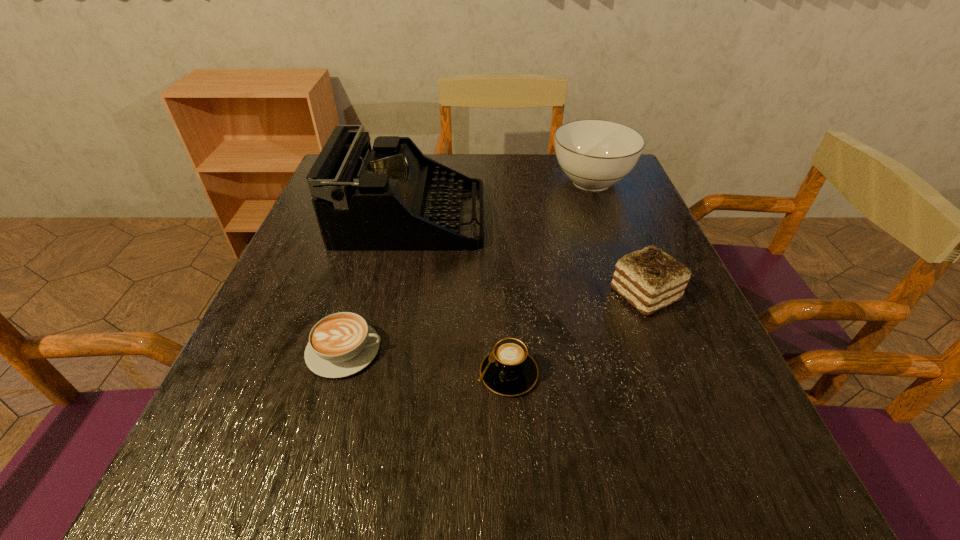
This screenshot has height=540, width=960. What are the coordinates of `free location located on the left of the chocolate cake` in the screenshot? It's located at (586, 294).

At what (x,y) coordinates should I click in order to perform the action: click on vacant area situated on the back of the right cappuccino. Please return your answer as a coordinate pair (x, y). Looking at the image, I should click on (501, 253).

Locate an element on the screen. Image resolution: width=960 pixels, height=540 pixels. vacant region located on the side of the shortest object with the handle is located at coordinates (572, 350).

In order to click on typewriter located in the far edge section of the desktop in this screenshot , I will do `click(390, 197)`.

You are a GUI agent. You are given a task and a screenshot of the screen. Output one action in this format:
    pyautogui.click(x=<x>, y=<y>)
    Task: Click on the chinaware that is at the far edge
    
    Given the screenshot: What is the action you would take?
    pyautogui.click(x=594, y=154)

Locate an element on the screen. typewriter at the left edge is located at coordinates (390, 197).

Identify the location of cappuccino that is at the left edge. The height and width of the screenshot is (540, 960). (341, 344).

You are a GUI agent. You are given a task and a screenshot of the screen. Output one action in this format:
    pyautogui.click(x=<x>, y=<y>)
    Task: Click on the chinaware at the right edge
    The width and height of the screenshot is (960, 540).
    Given the screenshot: What is the action you would take?
    pyautogui.click(x=594, y=154)

Identify the location of chocolate cake that is at the right edge. (649, 279).

At what (x,y) coordinates should I click in order to perform the action: click on object located at the far left corner. Please return your answer as a coordinate pair (x, y). Looking at the image, I should click on (390, 197).